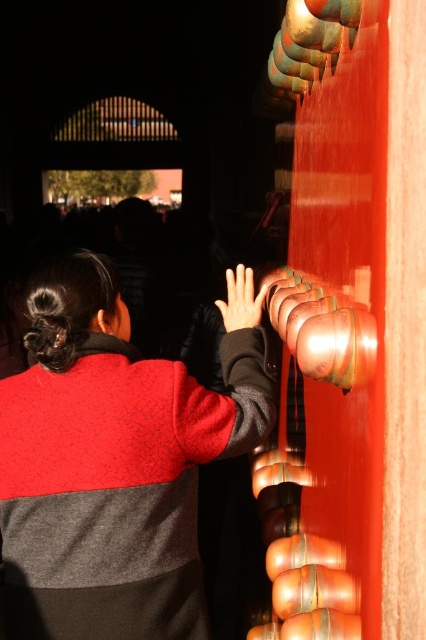
Can you confirm if speckled wool sweater at center is shorter than matte black hand at center?

Incorrect, speckled wool sweater at center's height does not fall short of matte black hand at center's.

Which is behind, point (172, 506) or point (232, 310)?

The point (232, 310) is more distant.

This screenshot has height=640, width=426. What are the coordinates of `speckled wool sweater at center` in the screenshot? It's located at (112, 465).